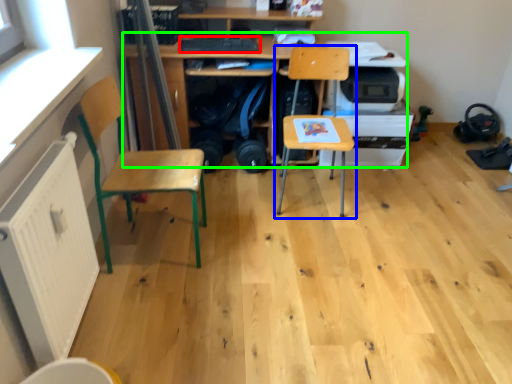
Question: Based on their relative distances, which object is farther from keyboard (highlighted by a red box)? Choose from chair (highlighted by a blue box) and desk (highlighted by a green box).

Choices:
 (A) chair
 (B) desk

Answer: (A)